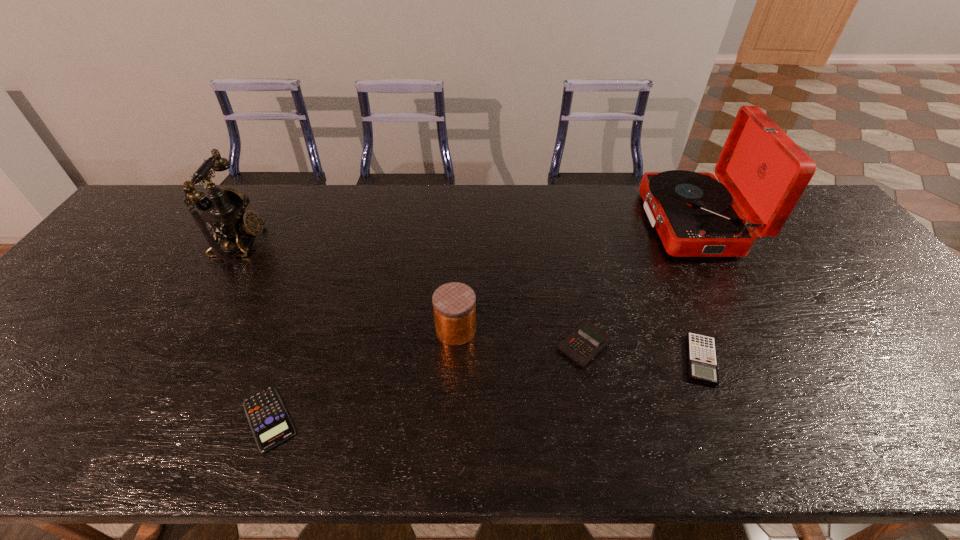
This screenshot has width=960, height=540. I want to click on vacant space that satisfies the following two spatial constraints: 1. on the back side of the fifth object from right to left; 2. on the left side of the fourth object from left to right, so click(x=296, y=345).

The height and width of the screenshot is (540, 960). Identify the location of free space that satisfies the following two spatial constraints: 1. on the back side of the leftmost calculator; 2. on the right side of the jar. (301, 330).

Locate an element on the screen. The width and height of the screenshot is (960, 540). vacant space that satisfies the following two spatial constraints: 1. on the front-facing side of the phonograph_record; 2. on the front side of the fourth object from right to left is located at coordinates (752, 330).

Find the location of a particular element. free space that satisfies the following two spatial constraints: 1. on the rotary dial of the leftmost object; 2. on the right side of the third object from left to right is located at coordinates (189, 330).

Where is `vacant region that satisfies the following two spatial constraints: 1. on the rotary dial of the fifth shortest object; 2. on the back side of the leftmost calculator`? The height and width of the screenshot is (540, 960). vacant region that satisfies the following two spatial constraints: 1. on the rotary dial of the fifth shortest object; 2. on the back side of the leftmost calculator is located at coordinates (137, 418).

You are a GUI agent. You are given a task and a screenshot of the screen. Output one action in this format:
    pyautogui.click(x=<x>, y=<y>)
    Task: Click on the free space that satisfies the following two spatial constraints: 1. on the rotary dial of the shortest calculator; 2. on the right side of the telephone
    The height and width of the screenshot is (540, 960).
    Given the screenshot: What is the action you would take?
    pyautogui.click(x=137, y=418)

Where is `vacant position in the image that satisfies the following two spatial constraints: 1. on the rotary dial of the second tallest object; 2. on the back side of the jar`? Image resolution: width=960 pixels, height=540 pixels. vacant position in the image that satisfies the following two spatial constraints: 1. on the rotary dial of the second tallest object; 2. on the back side of the jar is located at coordinates (189, 330).

The height and width of the screenshot is (540, 960). In order to click on vacant space that satisfies the following two spatial constraints: 1. on the back side of the shortest calculator; 2. on the rotary dial of the second tallest object in this screenshot , I will do 332,243.

The width and height of the screenshot is (960, 540). Find the location of `vacant area in the image that satisfies the following two spatial constraints: 1. on the rotary dial of the jar; 2. on the left side of the leftmost object`. vacant area in the image that satisfies the following two spatial constraints: 1. on the rotary dial of the jar; 2. on the left side of the leftmost object is located at coordinates (189, 330).